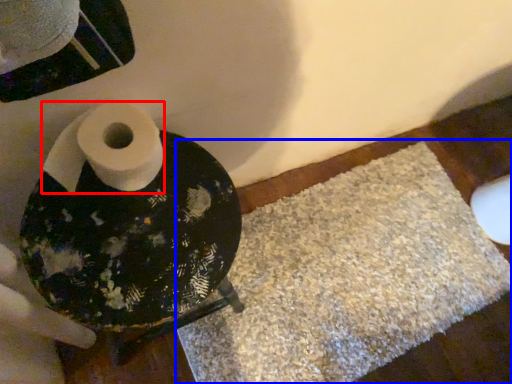
Question: Which object is closer to the camera taking this photo, toilet paper (highlighted by a red box) or bath mat (highlighted by a blue box)?

Choices:
 (A) toilet paper
 (B) bath mat

Answer: (A)